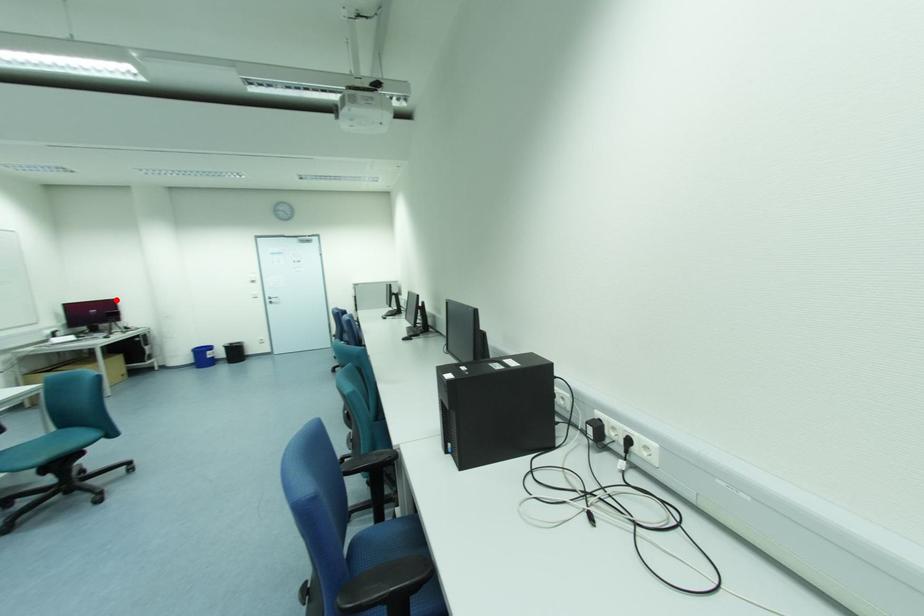
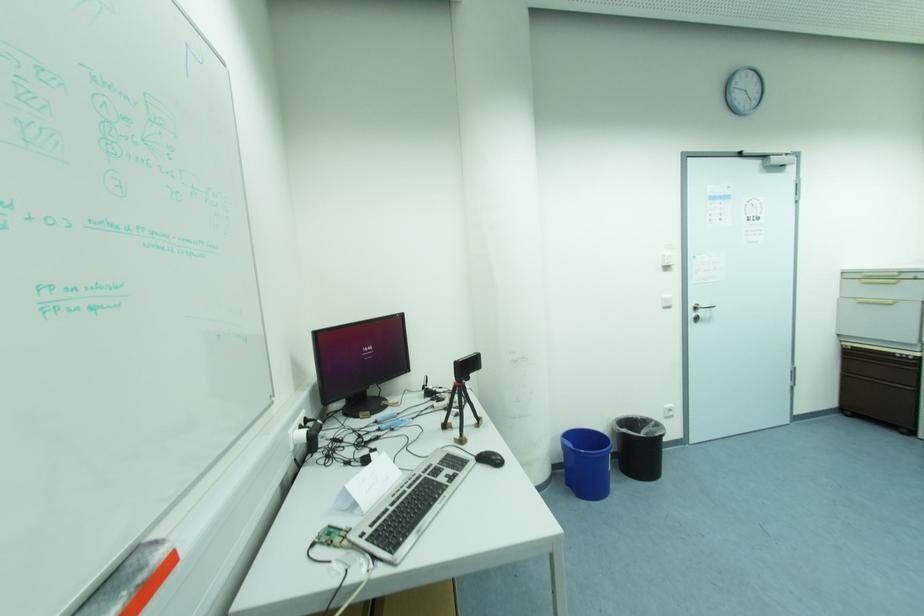
In the second image, find the point that corresponds to the highlighted location in the first image.

(402, 317)